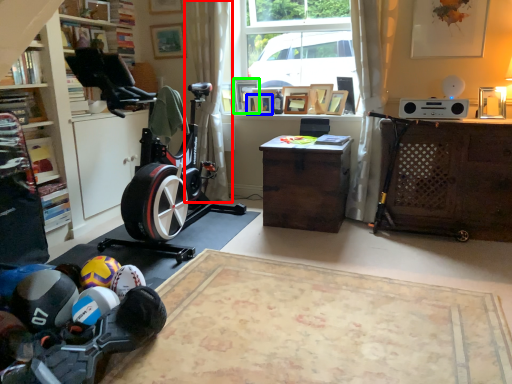
Question: Which object is the farthest from curtain (highlighted by a red box)? Choose among these: picture frame (highlighted by a blue box) or picture frame (highlighted by a green box).

Choices:
 (A) picture frame
 (B) picture frame

Answer: (A)